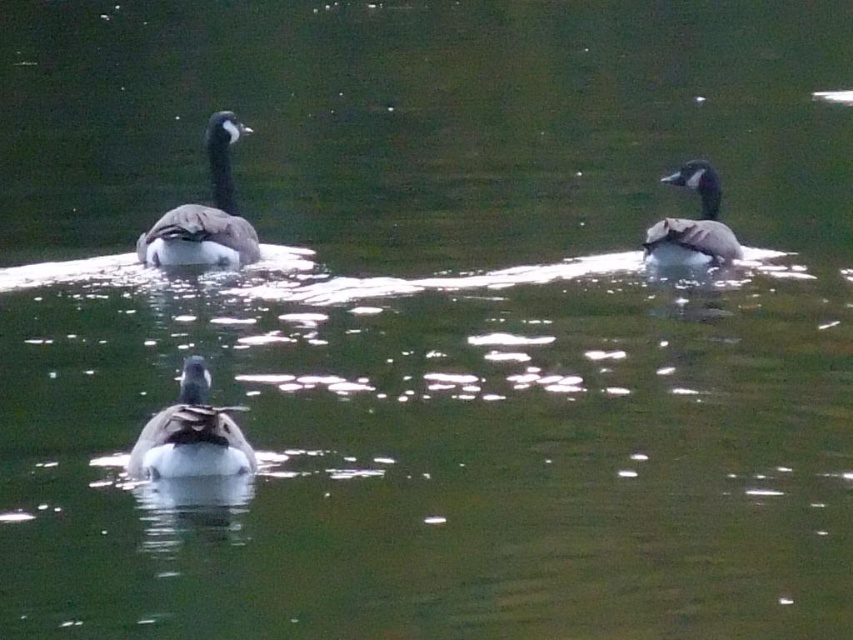
Question: Does dark gray matte duck at upper left have a greater width compared to dark brown feathers at upper right?

Choices:
 (A) yes
 (B) no

Answer: (A)

Question: Which point is closer to the camera?

Choices:
 (A) (660, 259)
 (B) (171, 472)
 (C) (223, 150)

Answer: (B)

Question: Can you confirm if dark gray matte duck at upper left is positioned below dark brown feathers at upper right?

Choices:
 (A) yes
 (B) no

Answer: (B)

Question: Estimate the real-world distances between objects in this image. Which object is closer to the dark gray matte duck at upper left?

Choices:
 (A) dark brown feathers at upper right
 (B) dark gray matte duck at center

Answer: (A)

Question: Does dark gray matte duck at center appear on the right side of dark brown feathers at upper right?

Choices:
 (A) yes
 (B) no

Answer: (B)

Question: Which point is farther to the camera?

Choices:
 (A) dark gray matte duck at center
 (B) dark gray matte duck at upper left
 (C) dark brown feathers at upper right

Answer: (C)